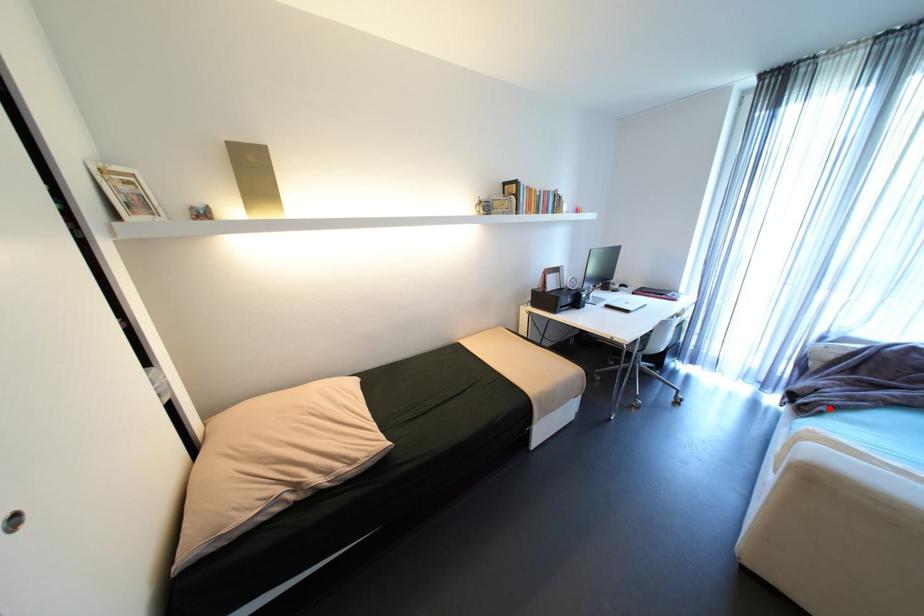
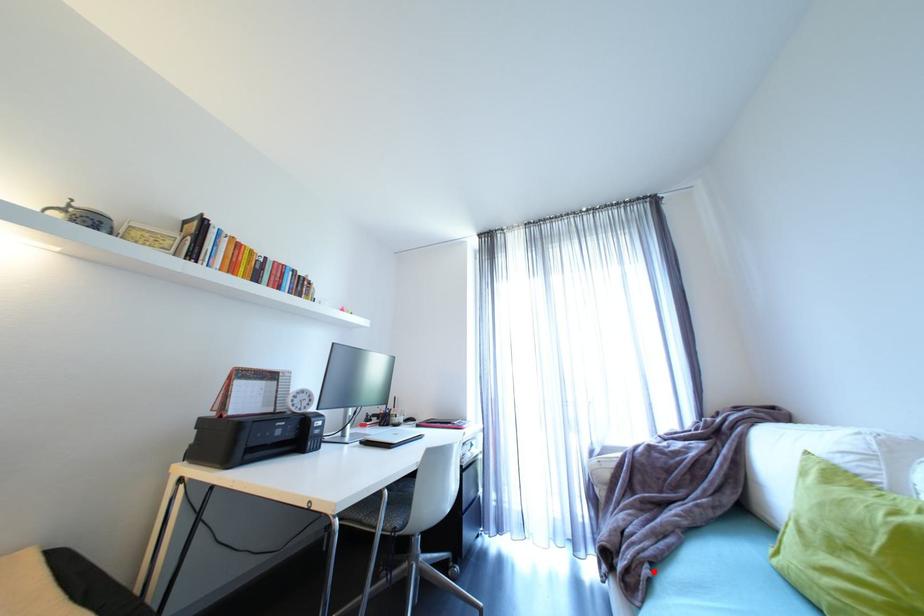
I am providing you with two images of the same scene from different viewpoints. A red point is marked on the first image and another point is marked on the second image. Are the points marked in image1 and image2 representing the same 3D position?

Yes